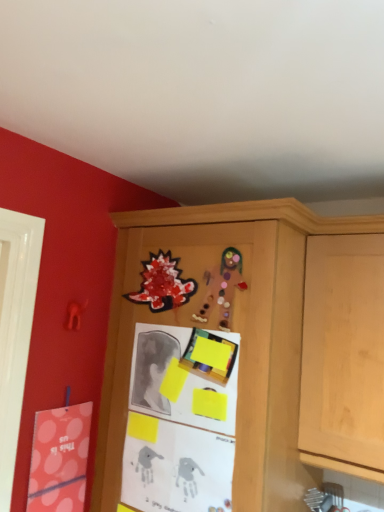
You are a GUI agent. You are given a task and a screenshot of the screen. Output one action in this format:
    pyautogui.click(x=<x>, y=<y>)
    Task: Click on the yellow paper at center
    
    Given the screenshot: What is the action you would take?
    pyautogui.click(x=179, y=423)

The height and width of the screenshot is (512, 384). Identify the location of yellow paper at center. (179, 423).

Is yellow paper at center facing towards matte pink postcard at left?

No, yellow paper at center is not aimed at matte pink postcard at left.

Consider the image. Which object is closer to the camera taking this photo, yellow paper at center or matte pink postcard at left?

yellow paper at center is more forward.

Where is `bulletin board above the matte pink postcard at left (from the image's perspective)`? The width and height of the screenshot is (384, 512). bulletin board above the matte pink postcard at left (from the image's perspective) is located at coordinates (179, 423).

From the image's perspective, would you say wooden cabinet at center is shown under glittery paper dinosaur at upper center, which ranks as the 2th art in right-to-left order?

Indeed, from the image's perspective, wooden cabinet at center is shown beneath glittery paper dinosaur at upper center, which ranks as the 2th art in right-to-left order.

Is wooden cabinet at center bigger than glittery paper dinosaur at upper center, which ranks as the 2th art in right-to-left order?

Correct, wooden cabinet at center is larger in size than glittery paper dinosaur at upper center, which ranks as the 2th art in right-to-left order.

Is wooden cabinet at center in front of glittery paper dinosaur at upper center, acting as the 1th art starting from the back?

That is True.

Are matte pink postcard at left and glittery paper dinosaur at upper center, acting as the 1th art starting from the back, located far from each other?

They are positioned close to each other.

I want to click on postcard located on the left of glittery paper dinosaur at upper center, which is counted as the 1th art, starting from the left, so click(59, 459).

From the image's perspective, which is below, matte pink postcard at left or glittery paper dinosaur at upper center, which ranks as the 2th art in right-to-left order?

matte pink postcard at left is shown below in the image.

Considering the sizes of objects matte pink postcard at left and glittery paper dinosaur at upper center, which ranks as the second art in front-to-back order, in the image provided, who is smaller, matte pink postcard at left or glittery paper dinosaur at upper center, which ranks as the second art in front-to-back order,?

glittery paper dinosaur at upper center, which ranks as the second art in front-to-back order.

From the image's perspective, relative to matte cardboard gingerbread man at upper center, positioned as the first art in front-to-back order, is wooden cabinet at center above or below?

Based on their image positions, wooden cabinet at center is located beneath matte cardboard gingerbread man at upper center, positioned as the first art in front-to-back order.

From the picture: Is wooden cabinet at center looking in the opposite direction of matte cardboard gingerbread man at upper center, the 2th art viewed from the back?

No, matte cardboard gingerbread man at upper center, the 2th art viewed from the back, is not at the back of wooden cabinet at center.

From the picture: Are wooden cabinet at center and matte cardboard gingerbread man at upper center, the 2th art viewed from the back, located far from each other?

wooden cabinet at center is near matte cardboard gingerbread man at upper center, the 2th art viewed from the back, not far away.

Between wooden cabinet at center and matte cardboard gingerbread man at upper center, the 2th art viewed from the back, which one has smaller width?

Thinner between the two is matte cardboard gingerbread man at upper center, the 2th art viewed from the back.

Does wooden cabinet at center touch matte pink postcard at left?

No, wooden cabinet at center is not with matte pink postcard at left.

Between wooden cabinet at center and matte pink postcard at left, which one has larger size?

A: wooden cabinet at center.

Based on the photo, is wooden cabinet at center positioned with its back to matte pink postcard at left?

No, wooden cabinet at center's orientation is not away from matte pink postcard at left.

Image resolution: width=384 pixels, height=512 pixels. Find the location of `postcard on the left of wooden cabinet at center`. postcard on the left of wooden cabinet at center is located at coordinates (59, 459).

Can you tell me how much matte cardboard gingerbread man at upper center, the 1th art in the right-to-left sequence, and yellow paper at center differ in facing direction?

0.0156 degrees separate the facing orientations of matte cardboard gingerbread man at upper center, the 1th art in the right-to-left sequence, and yellow paper at center.

You are a GUI agent. You are given a task and a screenshot of the screen. Output one action in this format:
    pyautogui.click(x=<x>, y=<y>)
    Task: Click on the 1st art behind the yellow paper at center, starting your count from the anchor
    The height and width of the screenshot is (512, 384).
    Given the screenshot: What is the action you would take?
    pyautogui.click(x=222, y=288)

Is matte cardboard gingerbread man at upper center, which appears as the second art when viewed from the left, in contact with yellow paper at center?

No, matte cardboard gingerbread man at upper center, which appears as the second art when viewed from the left, is not touching yellow paper at center.

Is the depth of matte cardboard gingerbread man at upper center, the 2th art viewed from the back, greater than that of yellow paper at center?

Yes, the depth of matte cardboard gingerbread man at upper center, the 2th art viewed from the back, is greater than that of yellow paper at center.

Consider the image. From the image's perspective, which is below, matte cardboard gingerbread man at upper center, the 1th art in the right-to-left sequence, or wooden cabinet at center?

wooden cabinet at center is shown below in the image.

What's the angular difference between matte cardboard gingerbread man at upper center, the 1th art in the right-to-left sequence, and wooden cabinet at center's facing directions?

There is a 0.483-degree angle between the facing directions of matte cardboard gingerbread man at upper center, the 1th art in the right-to-left sequence, and wooden cabinet at center.

Can you confirm if matte cardboard gingerbread man at upper center, positioned as the first art in front-to-back order, is thinner than wooden cabinet at center?

Correct, the width of matte cardboard gingerbread man at upper center, positioned as the first art in front-to-back order, is less than that of wooden cabinet at center.

Considering the relative positions of matte cardboard gingerbread man at upper center, the 2th art viewed from the back, and wooden cabinet at center in the image provided, is matte cardboard gingerbread man at upper center, the 2th art viewed from the back, to the right of wooden cabinet at center from the viewer's perspective?

In fact, matte cardboard gingerbread man at upper center, the 2th art viewed from the back, is to the left of wooden cabinet at center.

The width and height of the screenshot is (384, 512). What are the coordinates of `bulletin board located above the matte pink postcard at left (from the image's perspective)` in the screenshot? It's located at (179, 423).

Starting from the wooden cabinet at center, which art is the 2nd one behind? Please provide its 2D coordinates.

[(162, 284)]

From the image, which object appears to be nearer to yellow paper at center, matte pink postcard at left or glittery paper dinosaur at upper center, which is counted as the 1th art, starting from the left?

glittery paper dinosaur at upper center, which is counted as the 1th art, starting from the left, is closer to yellow paper at center.

From the picture: Considering their positions, is glittery paper dinosaur at upper center, which is counted as the 1th art, starting from the left, positioned closer to wooden cabinet at center than yellow paper at center?

Based on the image, yellow paper at center appears to be nearer to wooden cabinet at center.

Estimate the real-world distances between objects in this image. Which object is closer to glittery paper dinosaur at upper center, which is counted as the 1th art, starting from the left, matte cardboard gingerbread man at upper center, positioned as the first art in front-to-back order, or matte pink postcard at left?

Based on the image, matte cardboard gingerbread man at upper center, positioned as the first art in front-to-back order, appears to be nearer to glittery paper dinosaur at upper center, which is counted as the 1th art, starting from the left.

Looking at the image, which one is located closer to wooden cabinet at center, yellow paper at center or matte cardboard gingerbread man at upper center, which appears as the second art when viewed from the left?

The object closer to wooden cabinet at center is yellow paper at center.

Which object lies further to the anchor point yellow paper at center, matte cardboard gingerbread man at upper center, which appears as the second art when viewed from the left, or matte pink postcard at left?

The object further to yellow paper at center is matte pink postcard at left.

Based on their spatial positions, is yellow paper at center or wooden cabinet at center closer to matte cardboard gingerbread man at upper center, the 2th art viewed from the back?

Based on the image, wooden cabinet at center appears to be nearer to matte cardboard gingerbread man at upper center, the 2th art viewed from the back.

Based on their spatial positions, is matte cardboard gingerbread man at upper center, positioned as the first art in front-to-back order, or glittery paper dinosaur at upper center, which ranks as the 2th art in right-to-left order, closer to wooden cabinet at center?

Answer: Among the two, glittery paper dinosaur at upper center, which ranks as the 2th art in right-to-left order, is located nearer to wooden cabinet at center.

When comparing their distances from yellow paper at center, does wooden cabinet at center or matte cardboard gingerbread man at upper center, positioned as the first art in front-to-back order, seem further?

Among the two, matte cardboard gingerbread man at upper center, positioned as the first art in front-to-back order, is located further to yellow paper at center.

This screenshot has height=512, width=384. I want to click on bulletin board between glittery paper dinosaur at upper center, acting as the 1th art starting from the back, and matte pink postcard at left from top to bottom, so click(x=179, y=423).

Locate an element on the screen. art that lies between glittery paper dinosaur at upper center, which ranks as the second art in front-to-back order, and matte pink postcard at left from top to bottom is located at coordinates (222, 288).

Locate an element on the screen. Image resolution: width=384 pixels, height=512 pixels. art that lies between glittery paper dinosaur at upper center, acting as the 1th art starting from the back, and wooden cabinet at center from top to bottom is located at coordinates (222, 288).

Find the location of `cabinetry between glittery paper dinosaur at upper center, which is counted as the 1th art, starting from the left, and matte pink postcard at left, in the vertical direction`. cabinetry between glittery paper dinosaur at upper center, which is counted as the 1th art, starting from the left, and matte pink postcard at left, in the vertical direction is located at coordinates (234, 324).